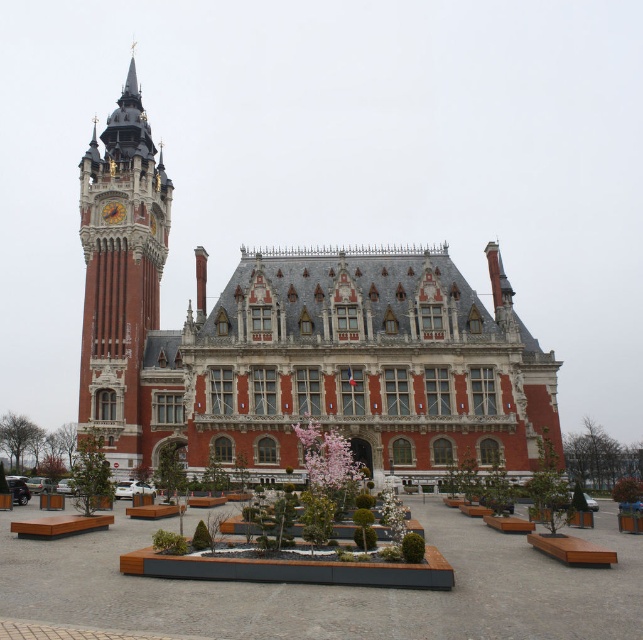
Question: Is wooden bench at center above gold metallic clock at upper left?

Choices:
 (A) yes
 (B) no

Answer: (B)

Question: Which object is positioned farthest from the red brick clock tower at left?

Choices:
 (A) wooden bench at center
 (B) red brick palace at center
 (C) gold metallic clock at upper left

Answer: (A)

Question: Does red brick palace at center have a smaller size compared to red brick clock tower at left?

Choices:
 (A) no
 (B) yes

Answer: (A)

Question: Is red brick palace at center above wooden bench at center?

Choices:
 (A) no
 (B) yes

Answer: (B)

Question: Estimate the real-world distances between objects in this image. Which object is closer to the red brick palace at center?

Choices:
 (A) gold metallic clock at upper left
 (B) red brick clock tower at left

Answer: (B)

Question: Among these points, which one is farthest from the camera?

Choices:
 (A) (111, 200)
 (B) (226, 401)
 (C) (14, 561)
 (D) (158, 317)

Answer: (D)